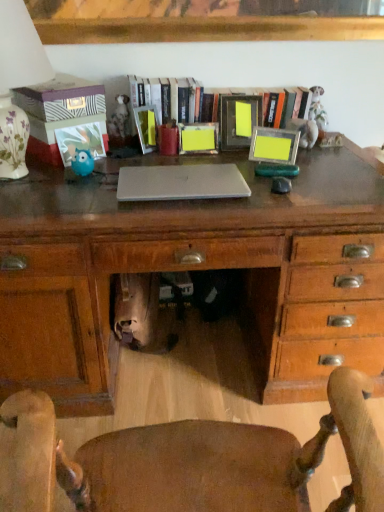
You are a GUI agent. You are given a task and a screenshot of the screen. Output one action in this format:
    pyautogui.click(x=<x>, y=<y>)
    Task: Click on the free space in front of porcelain floral table lamp at upper left
    The image size is (384, 512).
    Given the screenshot: What is the action you would take?
    pyautogui.click(x=41, y=209)